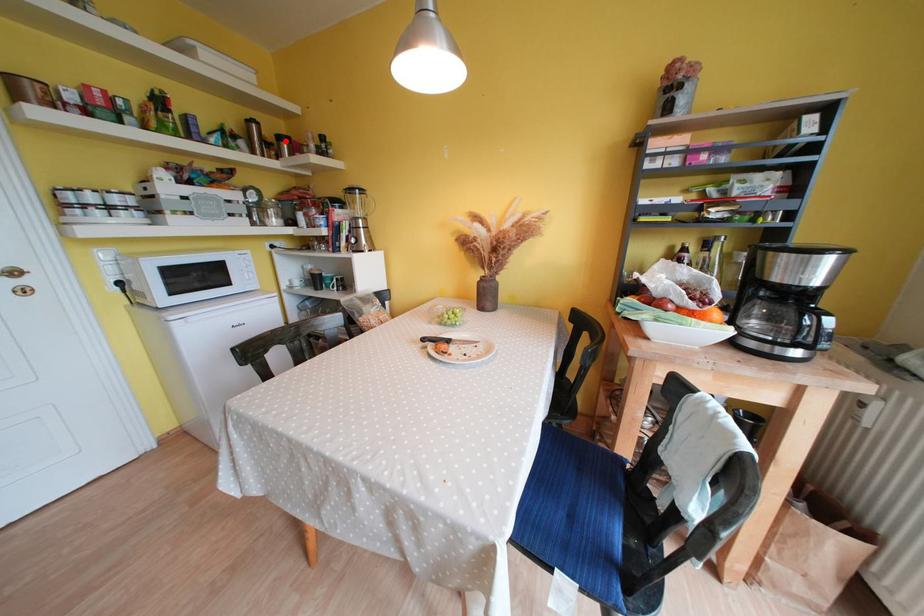
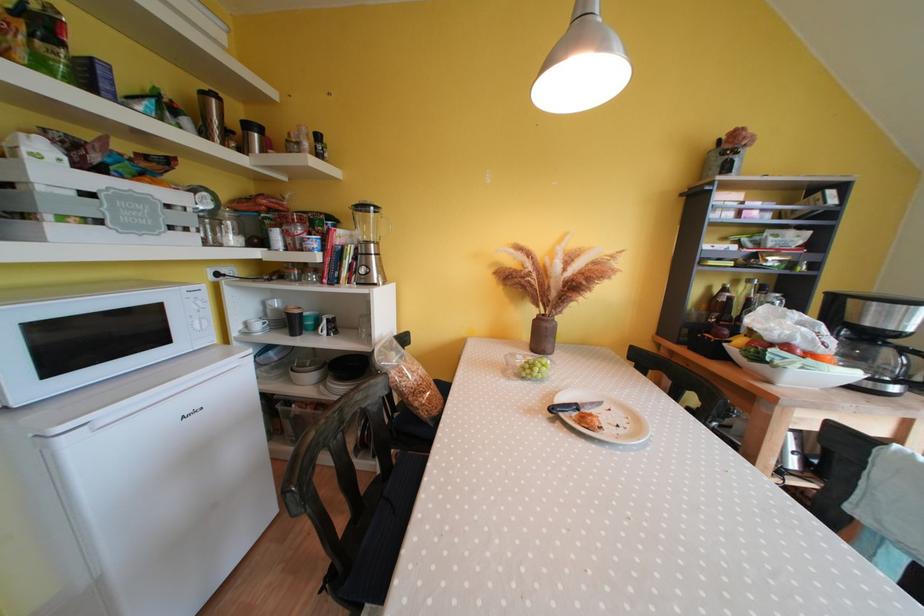
The point at the highlighted location is marked in the first image. Where is the corresponding point in the second image?

(252, 130)